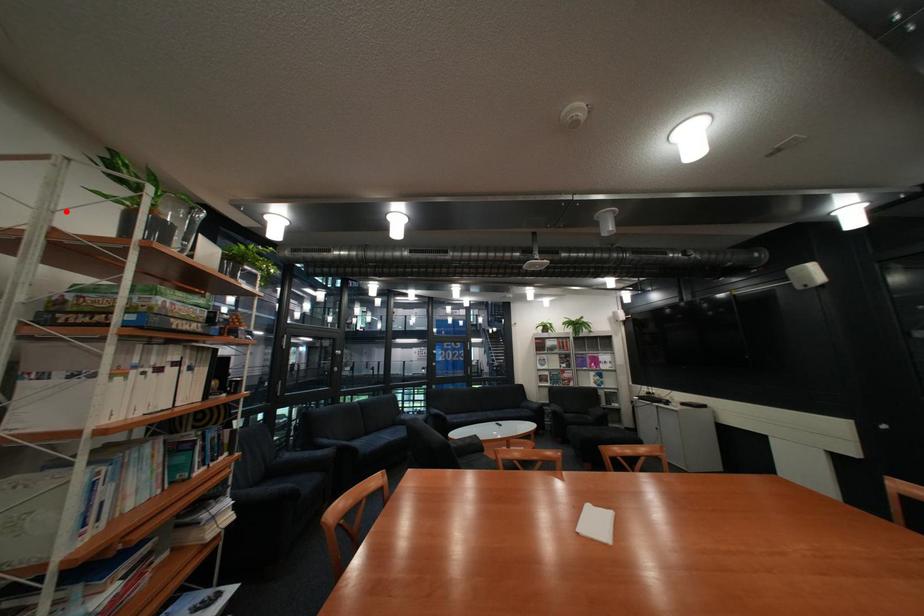
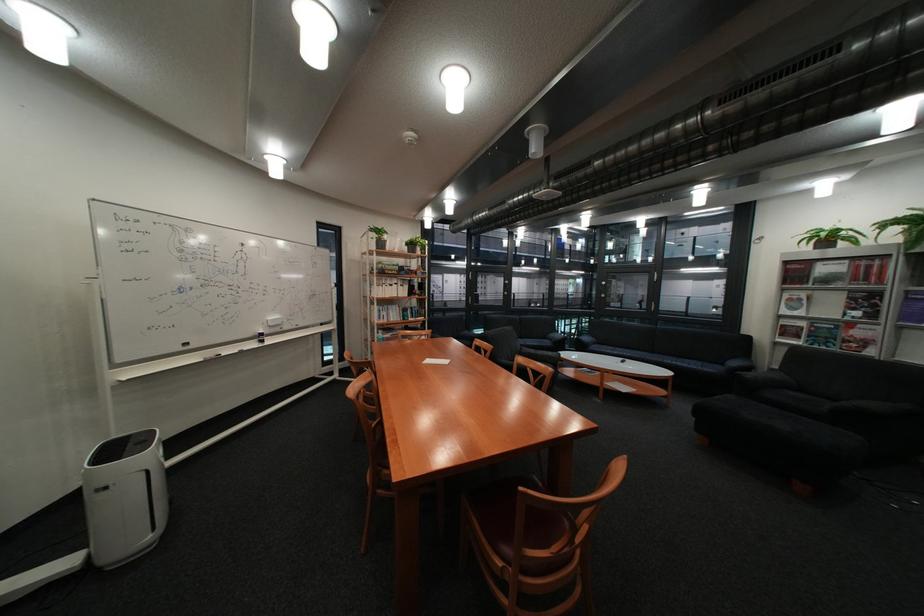
Question: I am providing you with two images of the same scene from different viewpoints. Given a red point in image1, look at the same physical point in image2. Is it:

Choices:
 (A) Closer to the viewpoint
 (B) Farther from the viewpoint

Answer: (A)